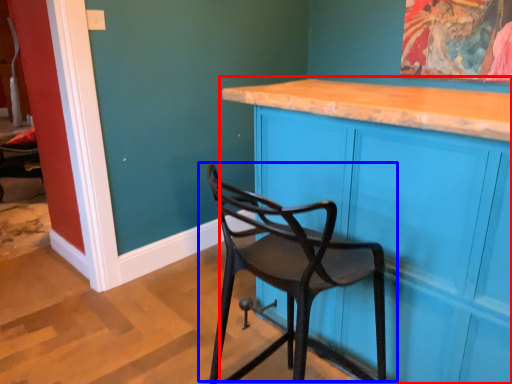
Question: Which object is further to the camera taking this photo, cabinetry (highlighted by a red box) or chair (highlighted by a blue box)?

Choices:
 (A) cabinetry
 (B) chair

Answer: (A)